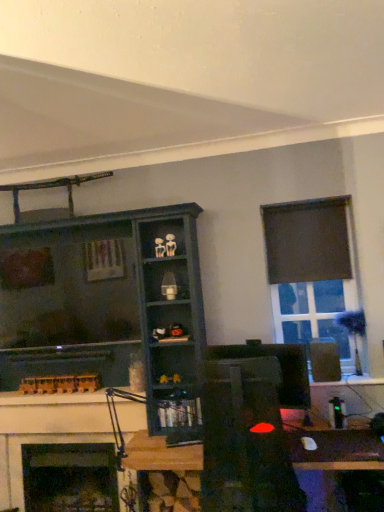
Question: Considering the relative positions of dark wood shelf at center, positioned as the second shelf in bottom-to-top order, and matte black monitor at center in the image provided, is dark wood shelf at center, positioned as the second shelf in bottom-to-top order, in front of matte black monitor at center?

Choices:
 (A) yes
 (B) no

Answer: (A)

Question: Considering the relative positions of dark wood shelf at center, positioned as the second shelf in bottom-to-top order, and matte black monitor at center in the image provided, is dark wood shelf at center, positioned as the second shelf in bottom-to-top order, to the left of matte black monitor at center from the viewer's perspective?

Choices:
 (A) no
 (B) yes

Answer: (B)

Question: Can you confirm if dark wood shelf at center, which is the 2th shelf from right to left, is taller than matte black monitor at center?

Choices:
 (A) no
 (B) yes

Answer: (B)

Question: From the image's perspective, is dark wood shelf at center, positioned as the second shelf in bottom-to-top order, on top of matte black monitor at center?

Choices:
 (A) yes
 (B) no

Answer: (A)

Question: Is the position of dark wood shelf at center, which is the first shelf in left-to-right order, more distant than that of matte black monitor at center?

Choices:
 (A) no
 (B) yes

Answer: (A)

Question: Is dark wood shelf at center, positioned as the second shelf in bottom-to-top order, shorter than matte black monitor at center?

Choices:
 (A) yes
 (B) no

Answer: (B)

Question: Is wooden desk at center to the left of white painted wood fireplace at lower left from the viewer's perspective?

Choices:
 (A) yes
 (B) no

Answer: (B)

Question: Is white painted wood fireplace at lower left completely or partially inside wooden desk at center?

Choices:
 (A) no
 (B) yes

Answer: (A)

Question: Is wooden desk at center turned away from white painted wood fireplace at lower left?

Choices:
 (A) no
 (B) yes

Answer: (A)

Question: Can you confirm if wooden desk at center is positioned to the right of white painted wood fireplace at lower left?

Choices:
 (A) no
 (B) yes

Answer: (B)

Question: From the image's perspective, does wooden desk at center appear lower than white painted wood fireplace at lower left?

Choices:
 (A) no
 (B) yes

Answer: (A)

Question: Considering the relative positions of wooden desk at center and white painted wood fireplace at lower left in the image provided, is wooden desk at center in front of white painted wood fireplace at lower left?

Choices:
 (A) yes
 (B) no

Answer: (A)

Question: Could matte black monitor at center be considered to be inside black plastic speaker at right?

Choices:
 (A) yes
 (B) no

Answer: (B)